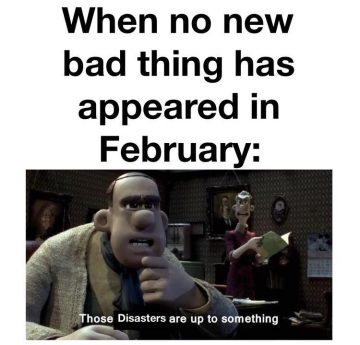
This screenshot has width=360, height=345. I want to click on booklet, so click(x=277, y=250).